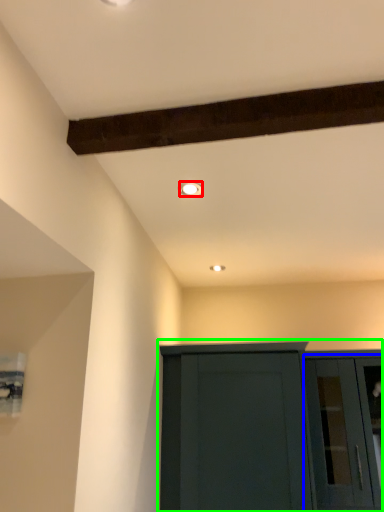
Question: Estimate the real-world distances between objects in this image. Which object is closer to lighting (highlighted by a red box), glass door (highlighted by a blue box) or cupboard (highlighted by a green box)?

Choices:
 (A) glass door
 (B) cupboard

Answer: (B)